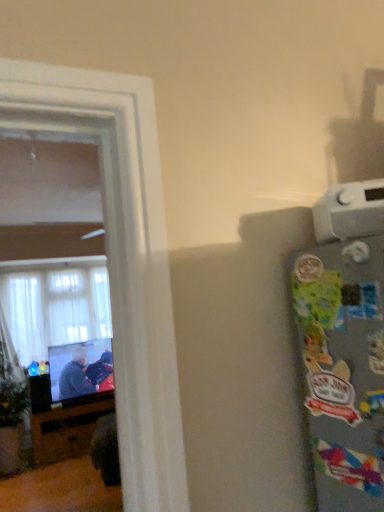
Image resolution: width=384 pixels, height=512 pixels. What do you see at coordinates (350, 211) in the screenshot? I see `white plastic thermostat at upper right` at bounding box center [350, 211].

Find the location of `dark gray sweater at left`. dark gray sweater at left is located at coordinates (75, 376).

Find the location of a particular element. white sheer curtains at left is located at coordinates (54, 303).

You are a GUI agent. You are given a task and a screenshot of the screen. Output one action in this format:
    pyautogui.click(x=<x>, y=<y>)
    Task: Click on the green matte plant at left
    
    Given the screenshot: What is the action you would take?
    pyautogui.click(x=11, y=390)

Between white sheer curtains at left and dark gray sweater at left, which one has smaller width?

With smaller width is dark gray sweater at left.

Measure the distance from white sheer curtains at left to dark gray sweater at left.

They are 36.78 inches apart.

Considering the relative sizes of white sheer curtains at left and dark gray sweater at left in the image provided, is white sheer curtains at left bigger than dark gray sweater at left?

Yes.

Which is further, (54,343) or (77,366)?

Point (54,343)

Is point (356, 234) closer or farther from the camera than point (73, 454)?

Clearly, point (356, 234) is closer to the camera than point (73, 454).

Is white plastic thermostat at upper right outside of black glossy entertainment center at left?

Yes.

Is white plastic thermostat at upper right in contact with black glossy entertainment center at left?

No, white plastic thermostat at upper right is not in contact with black glossy entertainment center at left.

From the picture: Which is more to the left, white plastic thermostat at upper right or green matte plant at left?

green matte plant at left is more to the left.

From a real-world perspective, is white plastic thermostat at upper right below green matte plant at left?

Incorrect, from a real-world perspective, white plastic thermostat at upper right is higher than green matte plant at left.

Does point (346, 231) appear closer or farther from the camera than point (14, 382)?

Point (346, 231) is positioned closer to the camera compared to point (14, 382).

Looking at the image, does dark gray sweater at left seem bigger or smaller compared to white plastic thermostat at upper right?

dark gray sweater at left is bigger than white plastic thermostat at upper right.

Is dark gray sweater at left outside of white plastic thermostat at upper right?

Absolutely, dark gray sweater at left is external to white plastic thermostat at upper right.

Is dark gray sweater at left looking in the opposite direction of white plastic thermostat at upper right?

No, dark gray sweater at left is not facing the opposite direction of white plastic thermostat at upper right.

Is dark gray sweater at left next to white plastic thermostat at upper right and touching it?

dark gray sweater at left and white plastic thermostat at upper right are clearly separated.

From the image's perspective, is green matte plant at left under white plastic thermostat at upper right?

Indeed, from the image's perspective, green matte plant at left is shown beneath white plastic thermostat at upper right.

Consider the image. Which of these two, green matte plant at left or white plastic thermostat at upper right, is wider?

A: green matte plant at left.

In the scene shown: From a real-world perspective, is green matte plant at left beneath white plastic thermostat at upper right?

Yes.

Considering the sizes of green matte plant at left and white plastic thermostat at upper right in the image, is green matte plant at left bigger or smaller than white plastic thermostat at upper right?

green matte plant at left is bigger than white plastic thermostat at upper right.

Is white sheer curtains at left looking in the opposite direction of black glossy entertainment center at left?

No.

Does white sheer curtains at left lie behind black glossy entertainment center at left?

Yes, white sheer curtains at left is behind black glossy entertainment center at left.

Considering the sizes of white sheer curtains at left and black glossy entertainment center at left in the image, is white sheer curtains at left bigger or smaller than black glossy entertainment center at left?

Considering their sizes, white sheer curtains at left takes up more space than black glossy entertainment center at left.

From a real-world perspective, between white sheer curtains at left and black glossy entertainment center at left, who is vertically higher?

white sheer curtains at left, from a real-world perspective.

From a real-world perspective, relative to dark gray sweater at left, is white plastic thermostat at upper right vertically above or below?

white plastic thermostat at upper right is above dark gray sweater at left.

Are white plastic thermostat at upper right and dark gray sweater at left far apart?

white plastic thermostat at upper right is positioned a significant distance from dark gray sweater at left.

Which is more to the right, white plastic thermostat at upper right or dark gray sweater at left?

white plastic thermostat at upper right.

Locate an element on the screen. thermostat in front of the dark gray sweater at left is located at coordinates (x=350, y=211).

Identify the location of person that is on the right side of white sheer curtains at left. (75, 376).

Identify the location of thermostat that is above the black glossy entertainment center at left (from the image's perspective). (350, 211).

From the image, which object appears to be farther from white sheer curtains at left, white plastic thermostat at upper right or green matte plant at left?

Based on the image, white plastic thermostat at upper right appears to be further to white sheer curtains at left.

Based on their spatial positions, is white plastic thermostat at upper right or white sheer curtains at left further from dark gray sweater at left?

white plastic thermostat at upper right lies further to dark gray sweater at left than the other object.

When comparing their distances from white plastic thermostat at upper right, does white sheer curtains at left or green matte plant at left seem closer?

green matte plant at left lies closer to white plastic thermostat at upper right than the other object.

Considering their positions, is white plastic thermostat at upper right positioned further to black glossy entertainment center at left than dark gray sweater at left?

white plastic thermostat at upper right is further to black glossy entertainment center at left.

Which object lies further to the anchor point white sheer curtains at left, white plastic thermostat at upper right or black glossy entertainment center at left?

white plastic thermostat at upper right.

From the image, which object appears to be nearer to black glossy entertainment center at left, white plastic thermostat at upper right or white sheer curtains at left?

Based on the image, white sheer curtains at left appears to be nearer to black glossy entertainment center at left.

When comparing their distances from white plastic thermostat at upper right, does dark gray sweater at left or white sheer curtains at left seem closer?

dark gray sweater at left.

Considering their positions, is white sheer curtains at left positioned further to green matte plant at left than black glossy entertainment center at left?

The object further to green matte plant at left is white sheer curtains at left.

Locate an element on the screen. entertainment center positioned between white plastic thermostat at upper right and white sheer curtains at left from near to far is located at coordinates (67, 429).

What are the coordinates of `plant between white sheer curtains at left and black glossy entertainment center at left from top to bottom` in the screenshot? It's located at (11, 390).

I want to click on plant between white plastic thermostat at upper right and black glossy entertainment center at left from front to back, so click(11, 390).

Where is `person between white sheer curtains at left and black glossy entertainment center at left in the up-down direction`? The height and width of the screenshot is (512, 384). person between white sheer curtains at left and black glossy entertainment center at left in the up-down direction is located at coordinates (75, 376).